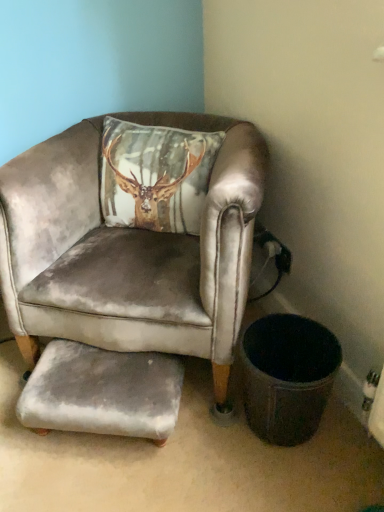
Locate an element on the screen. The width and height of the screenshot is (384, 512). free spot above gray velvety footrest at lower center (from a real-world perspective) is located at coordinates point(102,365).